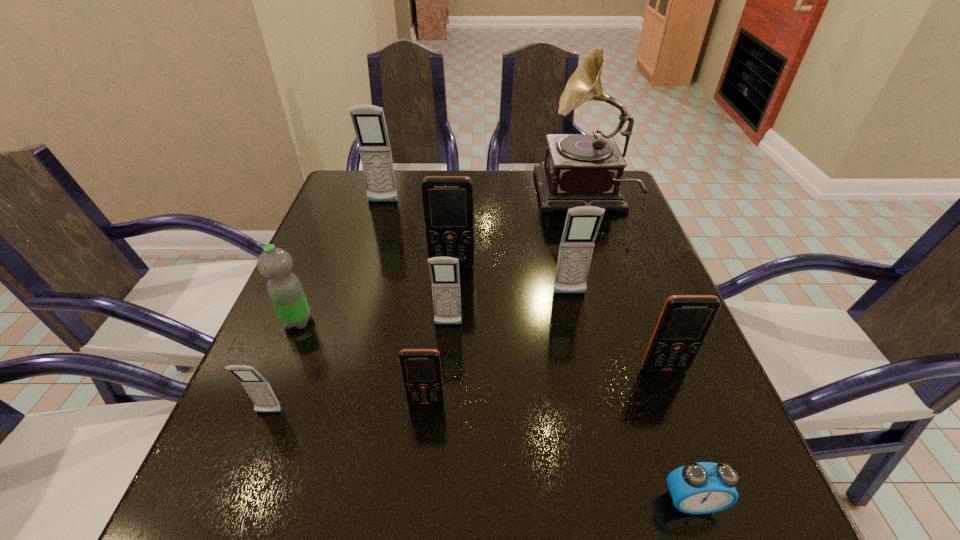
You are a GUI agent. You are given a task and a screenshot of the screen. Output one action in this format:
    pyautogui.click(x=<x>, y=<y>)
    Task: Click on the record player at the far edge
    Image resolution: width=960 pixels, height=540 pixels.
    Given the screenshot: What is the action you would take?
    pyautogui.click(x=579, y=170)

Locate an element on the screen. This screenshot has width=960, height=540. cellular telephone that is at the far edge is located at coordinates (369, 123).

Where is `object located at the near edge`? Image resolution: width=960 pixels, height=540 pixels. object located at the near edge is located at coordinates (705, 487).

Locate an element on the screen. This screenshot has height=540, width=960. water bottle that is at the left edge is located at coordinates (285, 290).

Identify the location of record player present at the right edge. (579, 170).

At what (x,y) coordinates should I click in order to perform the action: click on cellular telephone present at the right edge. Please return your answer as a coordinate pair (x, y). The height and width of the screenshot is (540, 960). Looking at the image, I should click on (685, 320).

Where is `alarm clock positioned at the right edge`? alarm clock positioned at the right edge is located at coordinates (705, 487).

I want to click on object that is at the far left corner, so click(x=369, y=123).

This screenshot has width=960, height=540. Identify the location of object that is at the far right corner. (579, 170).

The image size is (960, 540). I want to click on object located at the near right corner, so click(705, 487).